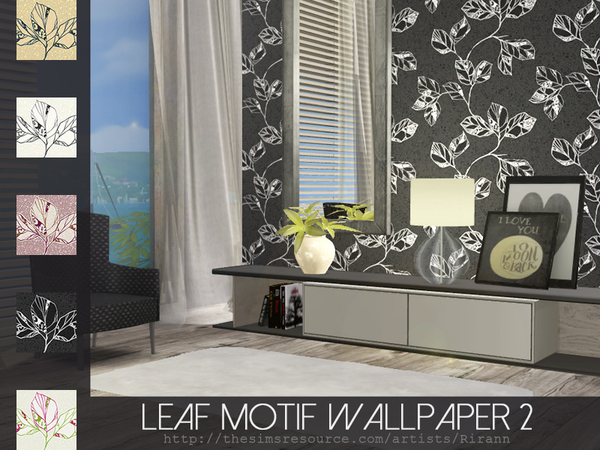
At what (x,y) coordinates should I click in order to perform the action: click on lampshade. Please return your answer as a coordinate pair (x, y). Image resolution: width=600 pixels, height=450 pixels. Looking at the image, I should click on (447, 210).